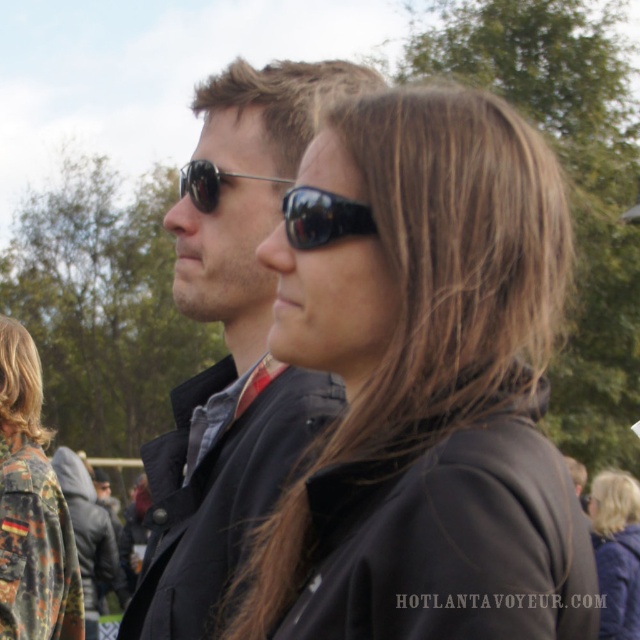
Question: Which of the following is the farthest from the observer?

Choices:
 (A) (301, 209)
 (B) (611, 500)

Answer: (B)

Question: Considering the relative positions of matte black jacket at center and camouflage jacket at lower left in the image provided, where is matte black jacket at center located with respect to camouflage jacket at lower left?

Choices:
 (A) above
 (B) below

Answer: (A)

Question: Which point appears farthest from the camera in this image?

Choices:
 (A) (592, 524)
 (B) (332, 220)
 (C) (509, 604)
 (D) (243, 499)

Answer: (A)

Question: Can you confirm if matte black sunglasses at center is positioned to the right of blonde hair at center?

Choices:
 (A) no
 (B) yes

Answer: (A)

Question: Is matte black sunglasses at center smaller than matte black jacket at center?

Choices:
 (A) yes
 (B) no

Answer: (A)

Question: Among these points, which one is farthest from the camera?

Choices:
 (A) (609, 570)
 (B) (356, 232)

Answer: (A)